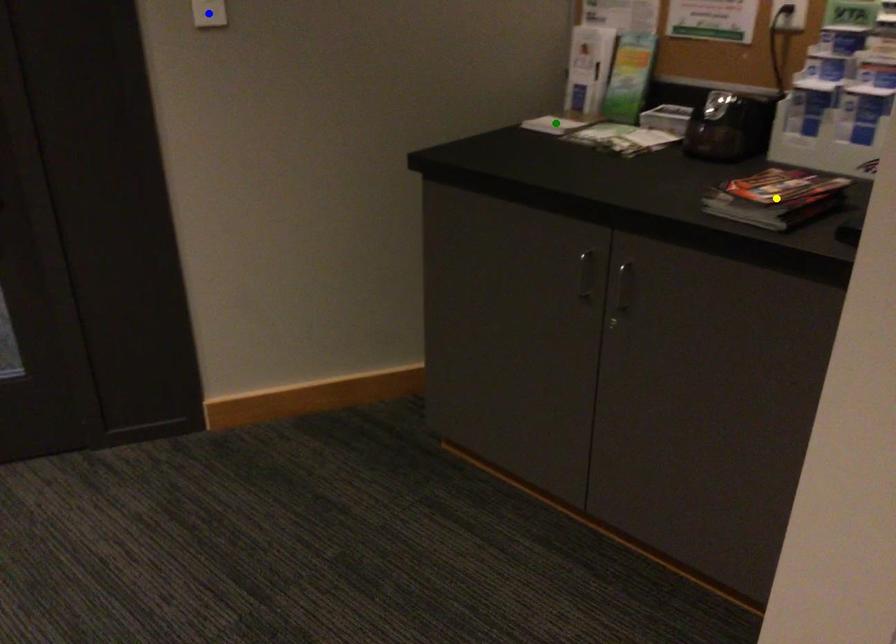
Order these from nearest to farthest:
1. green point
2. yellow point
3. blue point

yellow point → blue point → green point